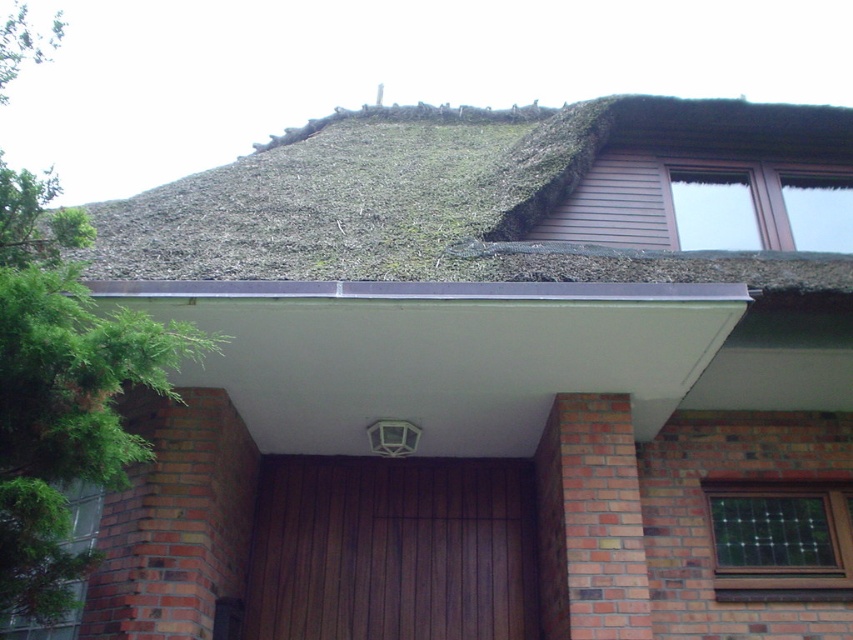
Between point (268, 156) and point (531, 561), which one is positioned in front?

Point (531, 561) is in front.

Measure the distance between green thatch roof at upper center and camera.

A distance of 13.63 feet exists between green thatch roof at upper center and camera.

Find the location of a particular element. green thatch roof at upper center is located at coordinates (456, 196).

Where is `green thatch roof at upper center`? green thatch roof at upper center is located at coordinates (456, 196).